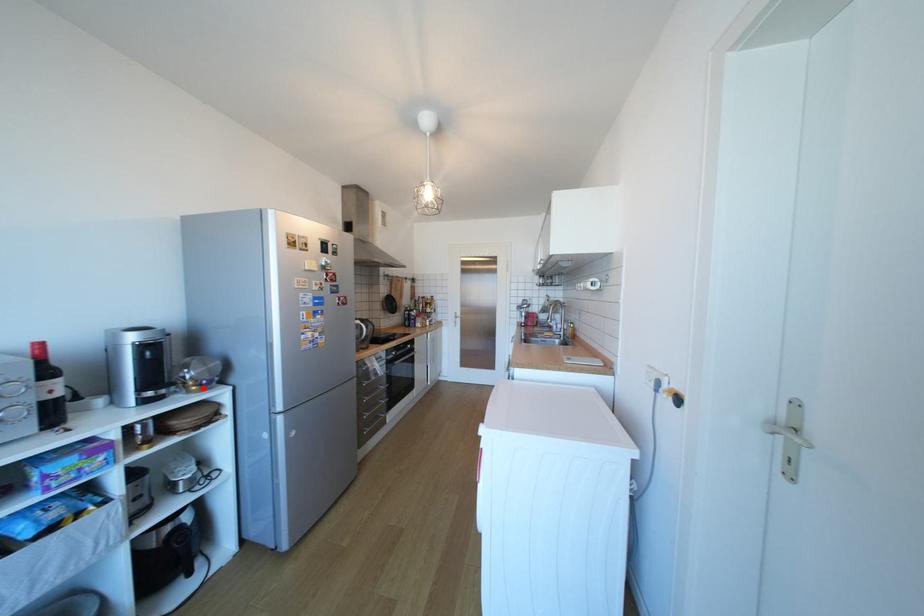
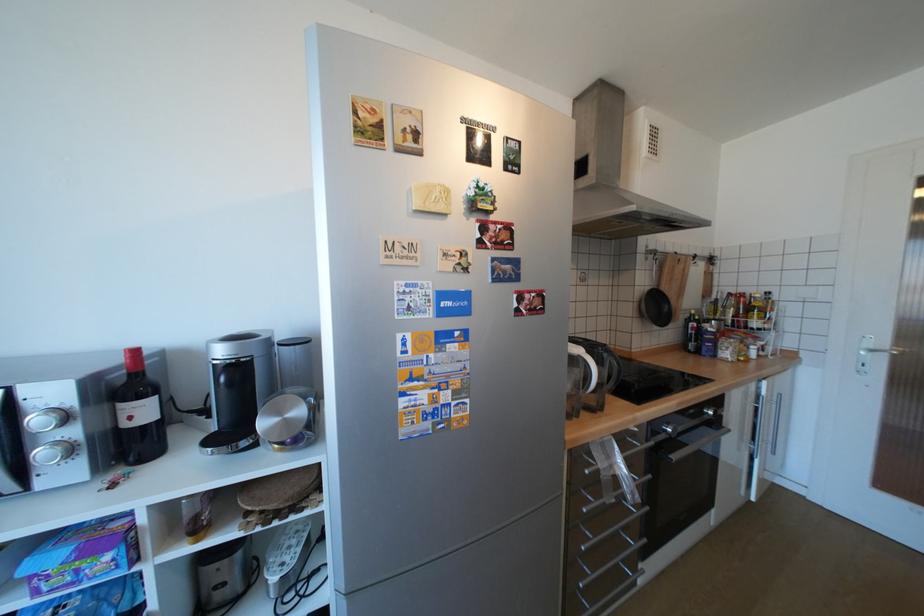
In the second image, find the point that corresponds to the highlighted location in the first image.

(286, 446)